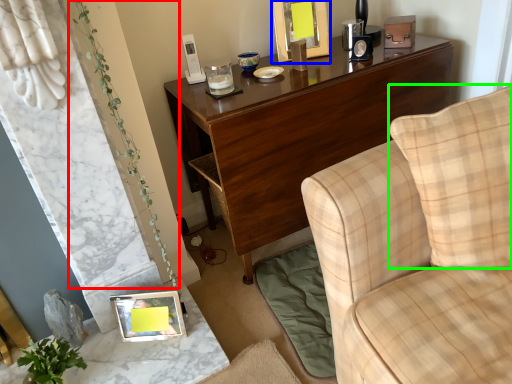
Question: Estimate the real-world distances between objects in this image. Which object is closer to plant (highlighted by a red box), picture frame (highlighted by a blue box) or pillow (highlighted by a green box)?

Choices:
 (A) picture frame
 (B) pillow

Answer: (B)